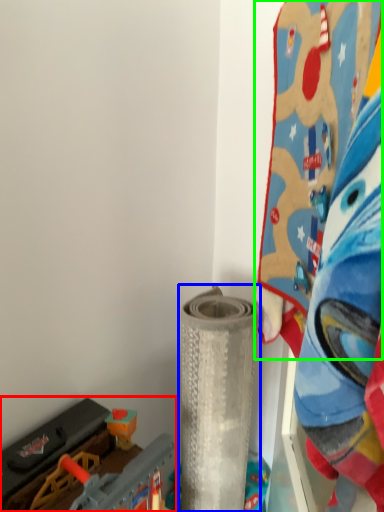
Question: Based on their relative distances, which object is nearer to toy (highlighted by a red box)? Choose from toy (highlighted by a blue box) and toy (highlighted by a green box).

Choices:
 (A) toy
 (B) toy

Answer: (A)